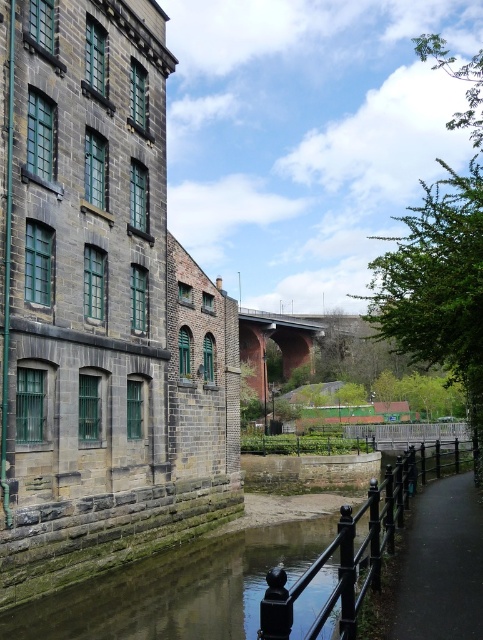
Is black asphalt path at lower right taller than brick arch bridge at center?

Incorrect, black asphalt path at lower right's height is not larger of brick arch bridge at center's.

Is black asphalt path at lower right smaller than brick arch bridge at center?

Indeed, black asphalt path at lower right has a smaller size compared to brick arch bridge at center.

Find the location of a particular element. black asphalt path at lower right is located at coordinates (440, 564).

How much distance is there between green mossy stone river at lower left and black metal/rail at lower center?

A distance of 3.62 meters exists between green mossy stone river at lower left and black metal/rail at lower center.

Does point (29, 627) come farther from viewer compared to point (357, 611)?

Yes, point (29, 627) is behind point (357, 611).

Is point (162, 612) closer to viewer compared to point (273, 577)?

No.

The height and width of the screenshot is (640, 483). What are the coordinates of `green mossy stone river at lower left` in the screenshot? It's located at (176, 589).

Between green mossy stone river at lower left and black asphalt path at lower right, which one appears on the left side from the viewer's perspective?

From the viewer's perspective, green mossy stone river at lower left appears more on the left side.

Which is in front, point (294, 552) or point (457, 561)?

Positioned in front is point (457, 561).

Identify the location of green mossy stone river at lower left. Image resolution: width=483 pixels, height=640 pixels. (176, 589).

This screenshot has width=483, height=640. I want to click on green mossy stone river at lower left, so click(x=176, y=589).